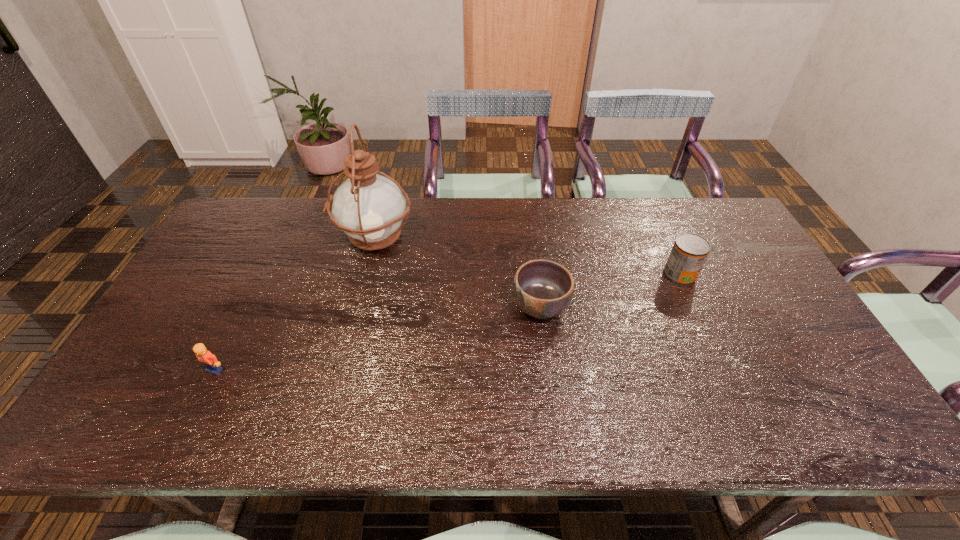
What are the coordinates of `object located in the far edge section of the desktop` in the screenshot? It's located at (368, 207).

Image resolution: width=960 pixels, height=540 pixels. Identify the location of free space at the far edge of the desktop. (452, 215).

In the image, there is a desktop. Find the location of `free space at the near edge`. free space at the near edge is located at coordinates (348, 433).

Find the location of a particular element. This screenshot has height=540, width=960. free spot at the left edge of the desktop is located at coordinates (x=223, y=247).

Image resolution: width=960 pixels, height=540 pixels. Find the location of `vacant space at the right edge of the desktop`. vacant space at the right edge of the desktop is located at coordinates (711, 253).

In the image, there is a desktop. Where is `blank space at the far left corner`? blank space at the far left corner is located at coordinates (255, 213).

Where is `vacant space at the near left corner of the desktop`? This screenshot has height=540, width=960. vacant space at the near left corner of the desktop is located at coordinates (143, 437).

This screenshot has height=540, width=960. In the image, there is a desktop. Identify the location of vacant space at the far right corner. (686, 205).

Identify the location of free point between the Lego and the bowl. (377, 338).

The width and height of the screenshot is (960, 540). Identify the location of blank region between the Lego and the can. (447, 322).